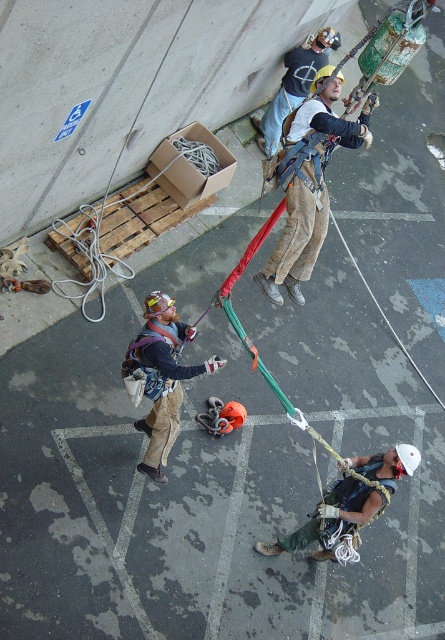
Based on the scene description, where is the matte black harness at upper center located in the image?

The matte black harness at upper center is located at point (308, 184) in the image.

You are a safety inspector checking the positioning of harnesses at a construction site. You observe the matte black harness at upper center. What are the coordinates of its position?

The position of the matte black harness at upper center is at point (x=308, y=184).

What object is located at the coordinates point (308,184)?

The object located at point (308,184) is the matte black harness at upper center.